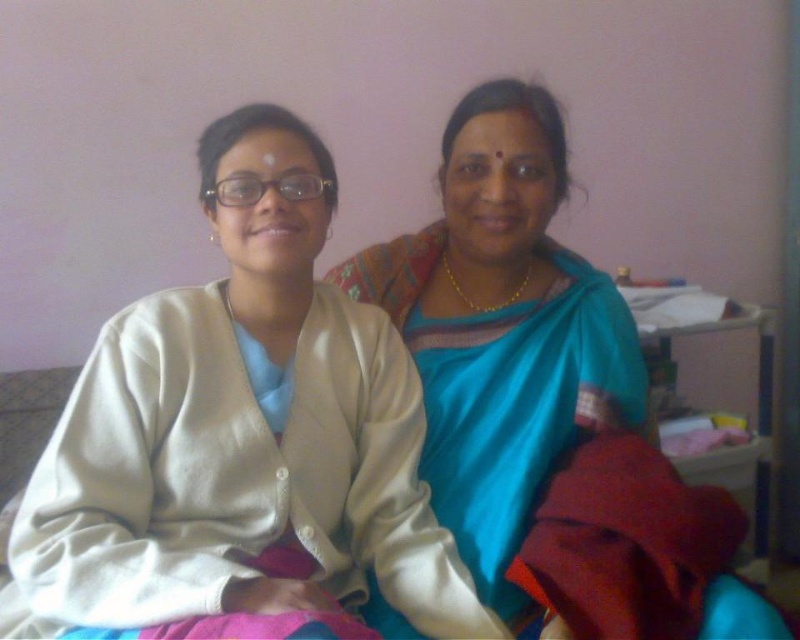
Question: Is silky blue saree at center below silky blue sari at center?

Choices:
 (A) yes
 (B) no

Answer: (A)

Question: Which point is closer to the camera taking this photo?

Choices:
 (A) (374, 248)
 (B) (214, 412)

Answer: (B)

Question: Can you confirm if silky blue saree at center is positioned to the right of silky blue sari at center?

Choices:
 (A) yes
 (B) no

Answer: (B)

Question: Is silky blue saree at center thinner than silky blue sari at center?

Choices:
 (A) yes
 (B) no

Answer: (B)